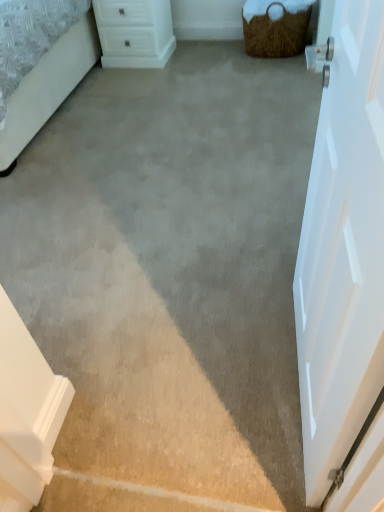
This screenshot has width=384, height=512. Identify the location of free space between white plastic chest of drawers at upper center and white smooth door at right. (182, 160).